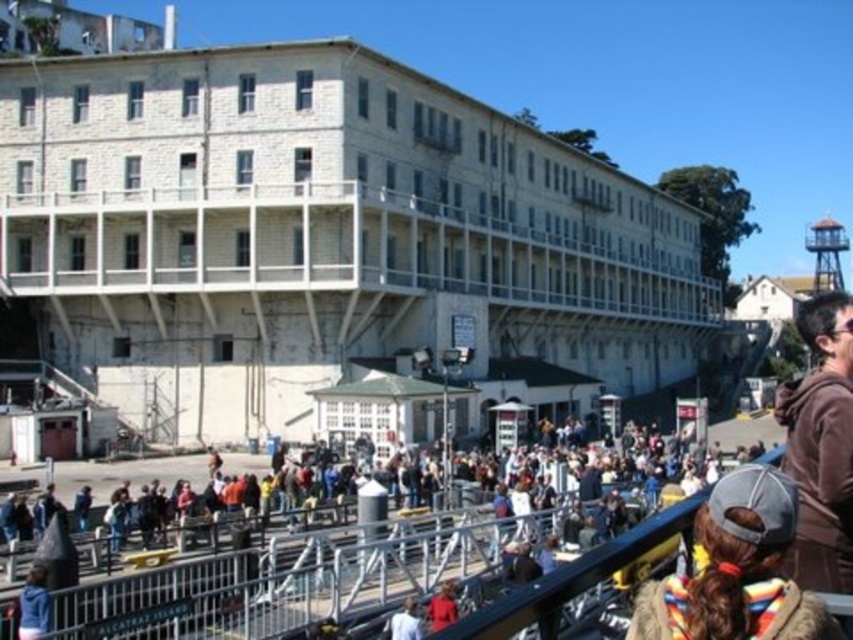
Find the location of `multicolored fur coat at lower right`. multicolored fur coat at lower right is located at coordinates (737, 570).

Based on the photo, does multicolored fur coat at lower right have a lesser height compared to brown fuzzy jacket at right?

Correct, multicolored fur coat at lower right is not as tall as brown fuzzy jacket at right.

This screenshot has height=640, width=853. Describe the element at coordinates (737, 570) in the screenshot. I see `multicolored fur coat at lower right` at that location.

You are a GUI agent. You are given a task and a screenshot of the screen. Output one action in this format:
    pyautogui.click(x=<x>, y=<y>)
    Task: Click on the multicolored fur coat at lower right
    This screenshot has height=640, width=853.
    Given the screenshot: What is the action you would take?
    pyautogui.click(x=737, y=570)